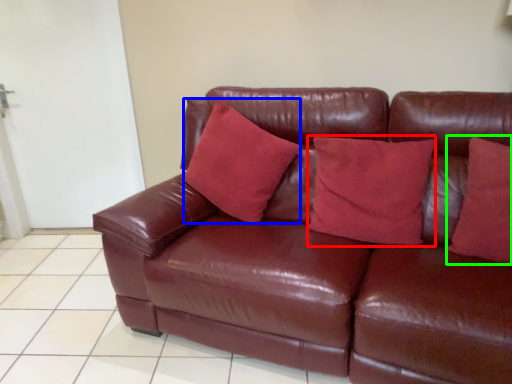
Question: Which is nearer to the pillow (highlighted by a red box)? pillow (highlighted by a blue box) or pillow (highlighted by a green box).

Choices:
 (A) pillow
 (B) pillow

Answer: (B)